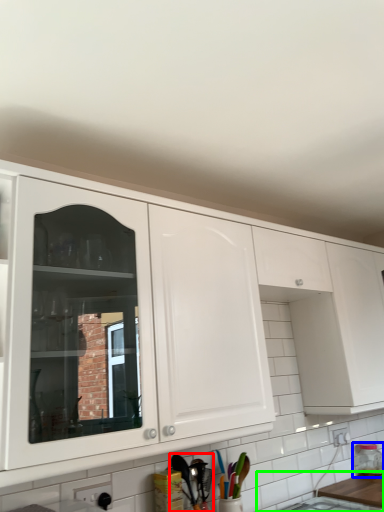
Question: Considering the real-world distances, which object is closest to cutlery (highlighted by a red box)? bottle (highlighted by a blue box) or counter top (highlighted by a green box).

Choices:
 (A) bottle
 (B) counter top

Answer: (B)